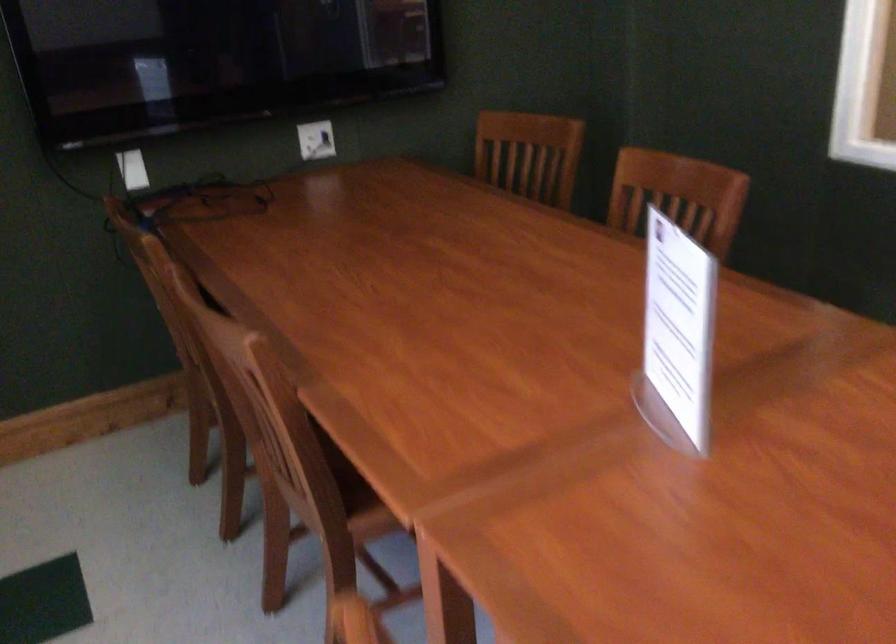
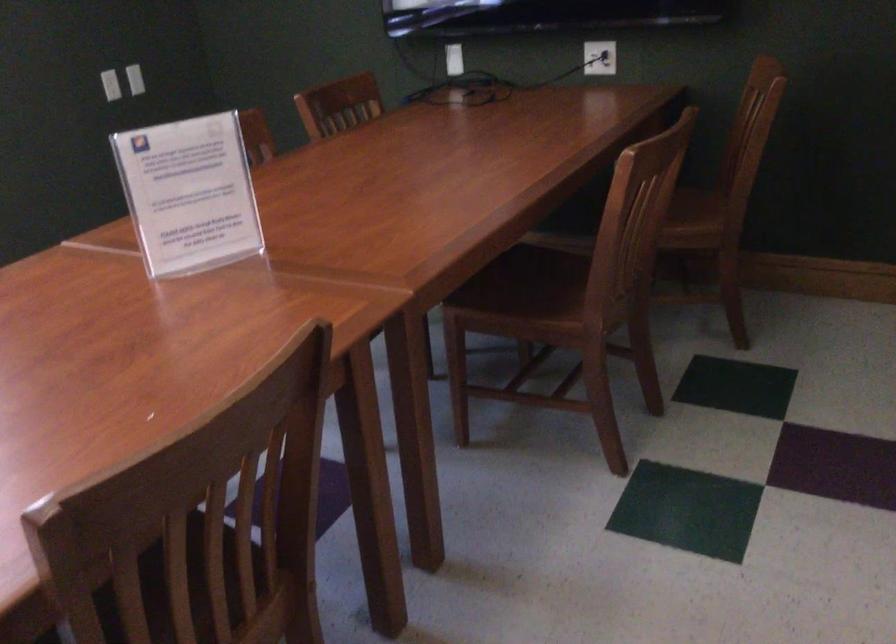
Question: I am providing you with two images of the same scene from different viewpoints. Which of the following objects are not visible in image2?

Choices:
 (A) yellow chair armrest
 (B) wooden chair sitting surface
 (C) clear sign holder
 (D) brown chair sitting surface

Answer: (B)